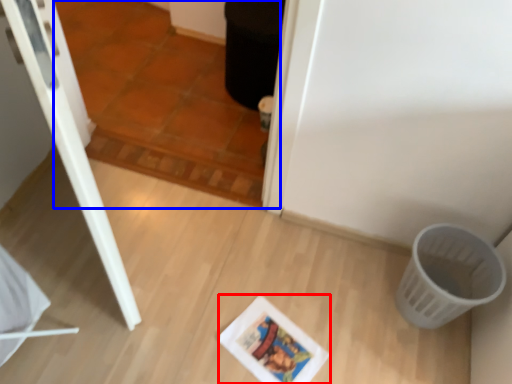
Question: Which object appears farthest to the camera in this image, comic book (highlighted by a red box) or tile (highlighted by a blue box)?

Choices:
 (A) comic book
 (B) tile

Answer: (A)